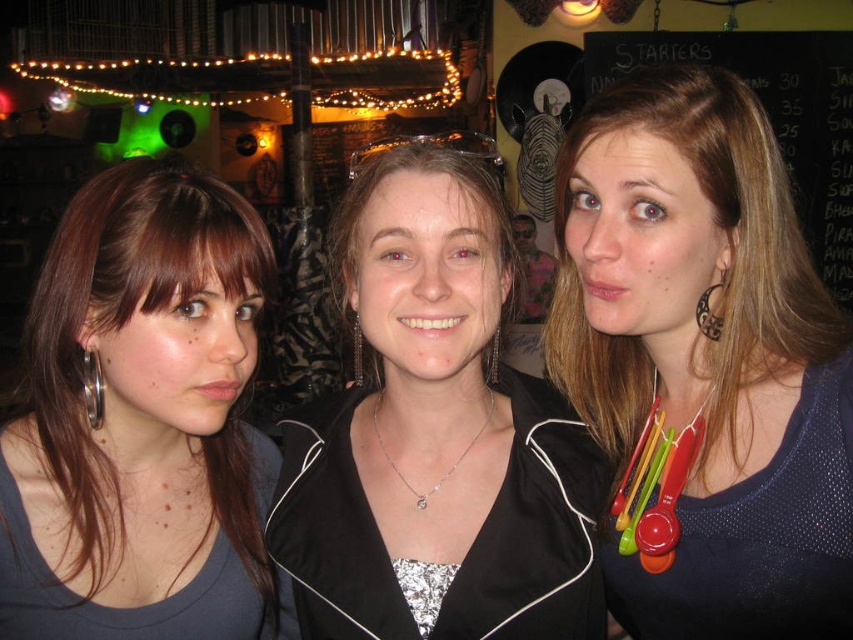
Question: Estimate the real-world distances between objects in this image. Which object is farther from the black chalkboard at upper right?

Choices:
 (A) matte gray tank top at left
 (B) silver metallic necklace at center
 (C) matte black necklace at center

Answer: (B)

Question: In this image, where is matte black necklace at center located relative to silver metallic hoop at ear left?

Choices:
 (A) below
 (B) above

Answer: (B)

Question: Which of these objects is positioned closest to the matte black necklace at center?

Choices:
 (A) silver metallic necklace at center
 (B) silver metallic hoop at ear left
 (C) black matte jacket at center

Answer: (C)

Question: Can you confirm if matte black necklace at center is positioned to the left of black matte jacket at center?

Choices:
 (A) yes
 (B) no

Answer: (B)

Question: Can you confirm if matte black necklace at center is smaller than black matte jacket at center?

Choices:
 (A) no
 (B) yes

Answer: (A)

Question: Which point appears farthest from the camera in this image?

Choices:
 (A) (354, 336)
 (B) (346, 492)

Answer: (A)